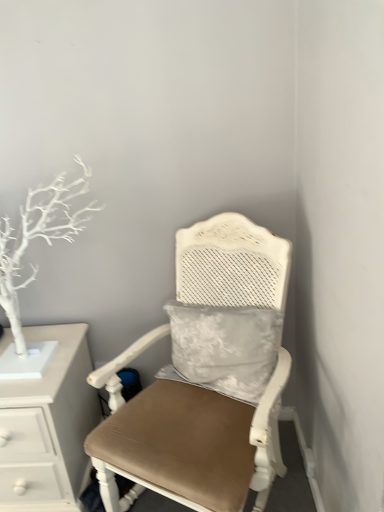
Question: From a real-world perspective, is matte white chair at center physically above white matte tree at left?

Choices:
 (A) no
 (B) yes

Answer: (A)

Question: Is matte white chair at center not close to white matte tree at left?

Choices:
 (A) yes
 (B) no

Answer: (B)

Question: Is matte white chair at center shorter than white matte tree at left?

Choices:
 (A) yes
 (B) no

Answer: (B)

Question: Is matte white chair at center oriented away from white matte tree at left?

Choices:
 (A) no
 (B) yes

Answer: (A)

Question: Is matte white chair at center positioned beyond the bounds of white matte tree at left?

Choices:
 (A) no
 (B) yes

Answer: (B)

Question: Does matte white chair at center appear on the right side of white matte tree at left?

Choices:
 (A) yes
 (B) no

Answer: (A)

Question: From the image's perspective, would you say white matte tree at left is positioned over white painted wood chest of drawers at left?

Choices:
 (A) no
 (B) yes

Answer: (B)

Question: Is white matte tree at left bigger than white painted wood chest of drawers at left?

Choices:
 (A) no
 (B) yes

Answer: (A)

Question: Considering the relative positions of white matte tree at left and white painted wood chest of drawers at left in the image provided, is white matte tree at left to the right of white painted wood chest of drawers at left from the viewer's perspective?

Choices:
 (A) no
 (B) yes

Answer: (B)

Question: Does white matte tree at left contain white painted wood chest of drawers at left?

Choices:
 (A) yes
 (B) no

Answer: (B)

Question: From a real-world perspective, is white matte tree at left over white painted wood chest of drawers at left?

Choices:
 (A) yes
 (B) no

Answer: (A)

Question: Does white matte tree at left have a smaller size compared to white painted wood chest of drawers at left?

Choices:
 (A) yes
 (B) no

Answer: (A)

Question: Is white painted wood chest of drawers at left positioned before matte white chair at center?

Choices:
 (A) no
 (B) yes

Answer: (A)